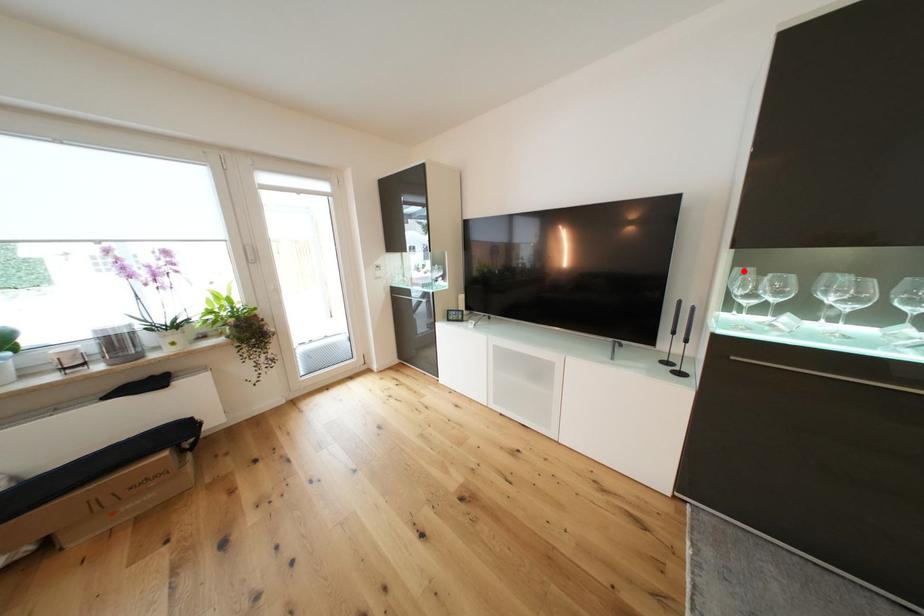
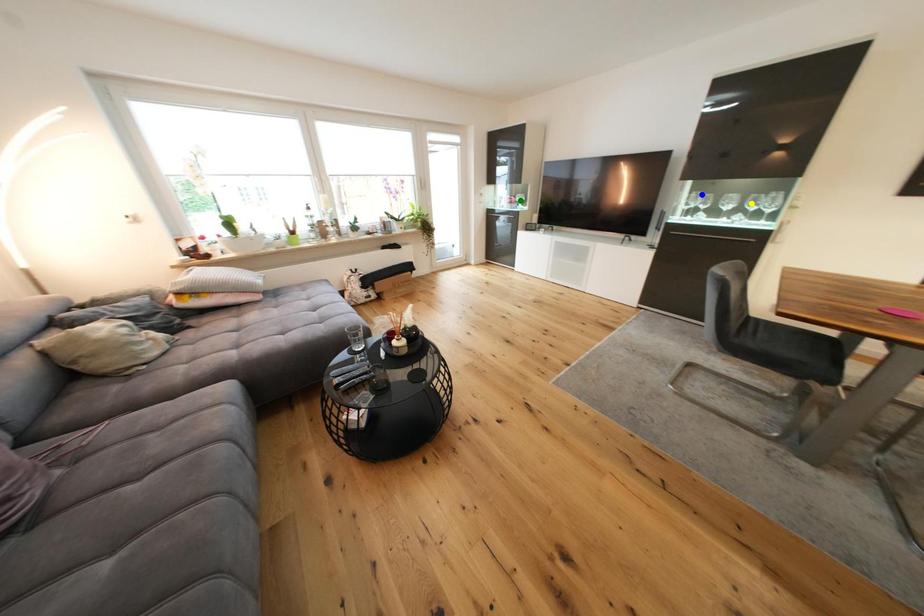
Question: I am providing you with two images of the same scene from different viewpoints. A red point is marked on the first image. You are given multiple points on the second image. In image 2, which mark is for the same physical point as the one in image 1?

Choices:
 (A) green point
 (B) yellow point
 (C) blue point

Answer: (C)